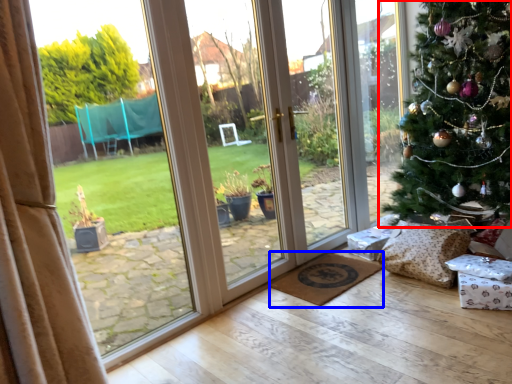
Question: Which object appears farthest to the camera in this image, christmas tree (highlighted by a red box) or doormat (highlighted by a blue box)?

Choices:
 (A) christmas tree
 (B) doormat

Answer: (B)